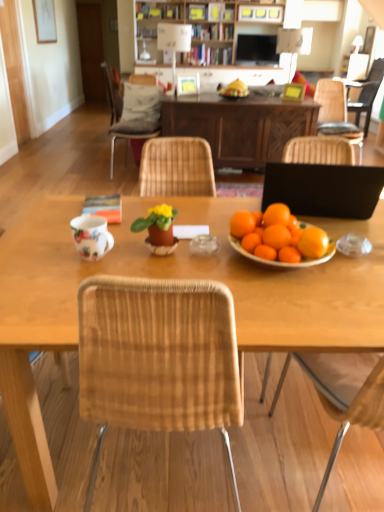
Locate an element on the screen. The height and width of the screenshot is (512, 384). vacant area that is in front of matte white picture frame at center, the second picture frame ordered from the bottom is located at coordinates (187, 94).